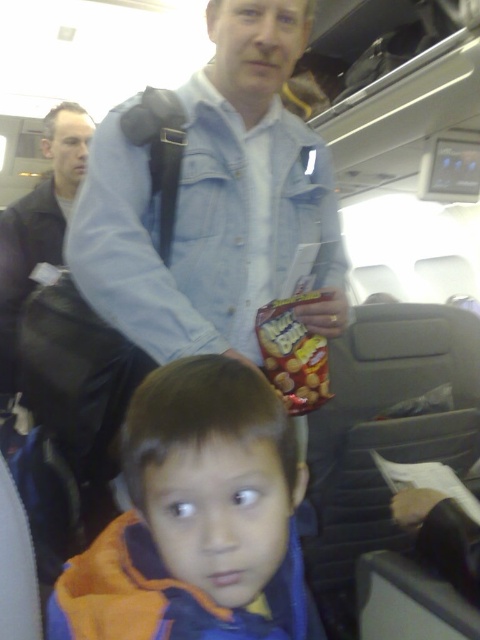
Question: Which of the following is the farthest from the observer?

Choices:
 (A) orange fleece jacket at lower left
 (B) denim jacket at upper center
 (C) matte black jacket at left

Answer: (C)

Question: Which is nearer to the orange fleece jacket at lower left?

Choices:
 (A) denim jacket at upper center
 (B) matte plastic snack packet at center
 (C) matte black jacket at left

Answer: (B)

Question: Can you confirm if matte black jacket at left is wider than matte plastic snack packet at center?

Choices:
 (A) yes
 (B) no

Answer: (A)

Question: Is denim jacket at upper center to the left of matte plastic snack packet at center from the viewer's perspective?

Choices:
 (A) no
 (B) yes

Answer: (B)

Question: Which is farther from the denim jacket at upper center?

Choices:
 (A) matte plastic snack packet at center
 (B) matte black jacket at left
 (C) orange fleece jacket at lower left

Answer: (B)

Question: Is denim jacket at upper center to the left of orange fleece jacket at lower left from the viewer's perspective?

Choices:
 (A) no
 (B) yes

Answer: (A)